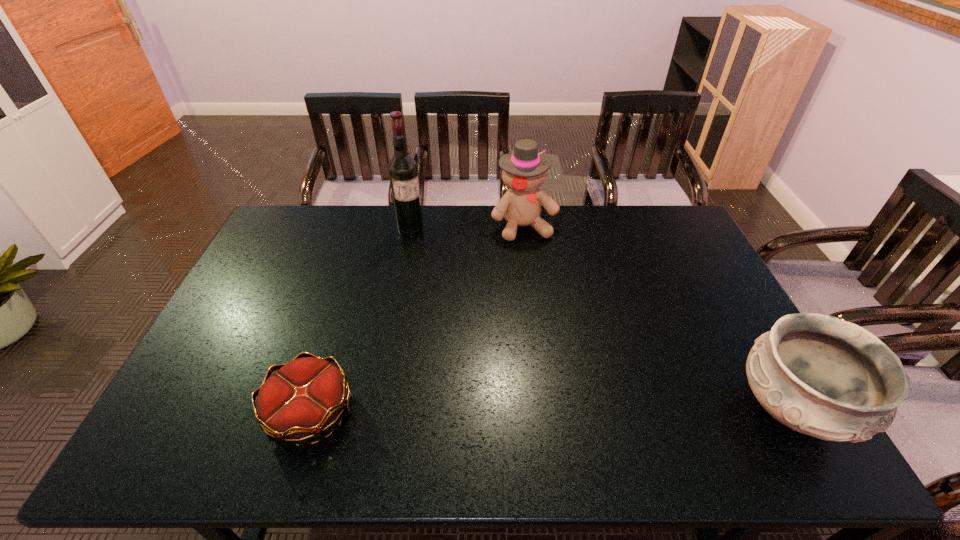
You are a GUI agent. You are given a task and a screenshot of the screen. Output one action in this format:
    pyautogui.click(x=<x>, y=<y>)
    Task: Click on the vacant area situated 0.220m on the front and back of the tallest object
    
    Given the screenshot: What is the action you would take?
    pyautogui.click(x=435, y=275)

Where is `vacant area located on the front and back of the tallest object`? The image size is (960, 540). vacant area located on the front and back of the tallest object is located at coordinates (429, 265).

This screenshot has height=540, width=960. Find the location of `free space located 0.250m on the front and back of the tallest object`. free space located 0.250m on the front and back of the tallest object is located at coordinates (439, 281).

The width and height of the screenshot is (960, 540). What are the coordinates of `vacant space located 0.190m on the front-facing side of the third object from left to right` in the screenshot? It's located at (550, 279).

This screenshot has width=960, height=540. What are the coordinates of `free point located on the front-facing side of the third object from left to right` in the screenshot? It's located at (543, 266).

The width and height of the screenshot is (960, 540). In order to click on free region located 0.230m on the front-facing side of the third object from left to right in this screenshot , I will do `click(554, 288)`.

Locate an element on the screen. Image resolution: width=960 pixels, height=540 pixels. wine bottle at the far edge is located at coordinates (403, 173).

Image resolution: width=960 pixels, height=540 pixels. What are the coordinates of `rag_doll present at the far edge` in the screenshot? It's located at (524, 171).

Locate an element on the screen. This screenshot has width=960, height=540. crown at the near edge is located at coordinates (302, 400).

Find the location of a particular element. pottery that is at the near edge is located at coordinates (821, 376).